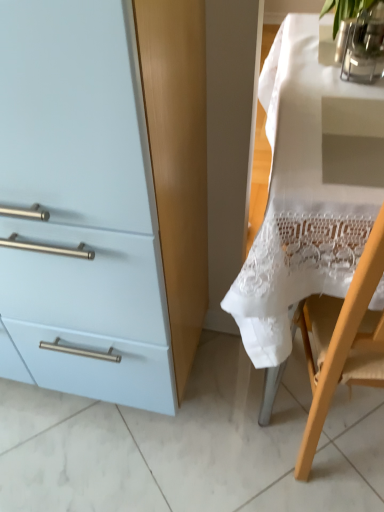
In order to click on free spot in front of clear glass vase at upper right, the 2th glass vase from the front in this screenshot , I will do click(330, 91).